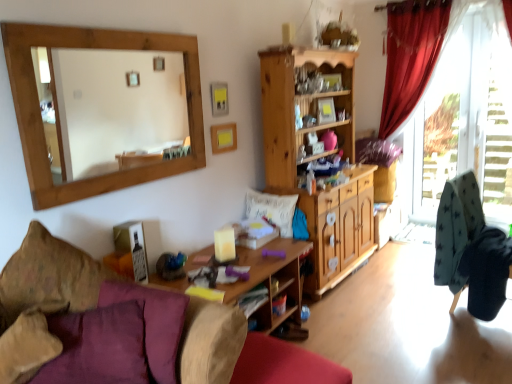
Question: Is point (23, 261) positioned closer to the camera than point (273, 326)?

Choices:
 (A) closer
 (B) farther

Answer: (A)

Question: From a real-world perspective, relative to woodenmaterial/texturetable at center, is velvet purple pillow at lower left, placed as the first pillow when sorted from left to right, vertically above or below?

Choices:
 (A) below
 (B) above

Answer: (B)

Question: Which of these objects is positioned closest to the red velvet curtain at right?

Choices:
 (A) transparent glass door at right
 (B) white soft cushion at center, the first pillow viewed from the back
 (C) velvet purple cushion at lower left, marked as the 3th pillow in a back-to-front arrangement
 (D) wooden mirror at upper left
 (E) wooden cabinet at center

Answer: (A)

Question: Considering the real-world distances, which object is farthest from the velvet purple cushion at lower left?

Choices:
 (A) woodenmaterial/texturetable at center
 (B) velvet purple cushion at lower left, marked as the 3th pillow in a back-to-front arrangement
 (C) teal fabric rocking chair at right
 (D) wooden cabinet at center
 (E) transparent glass door at right

Answer: (E)